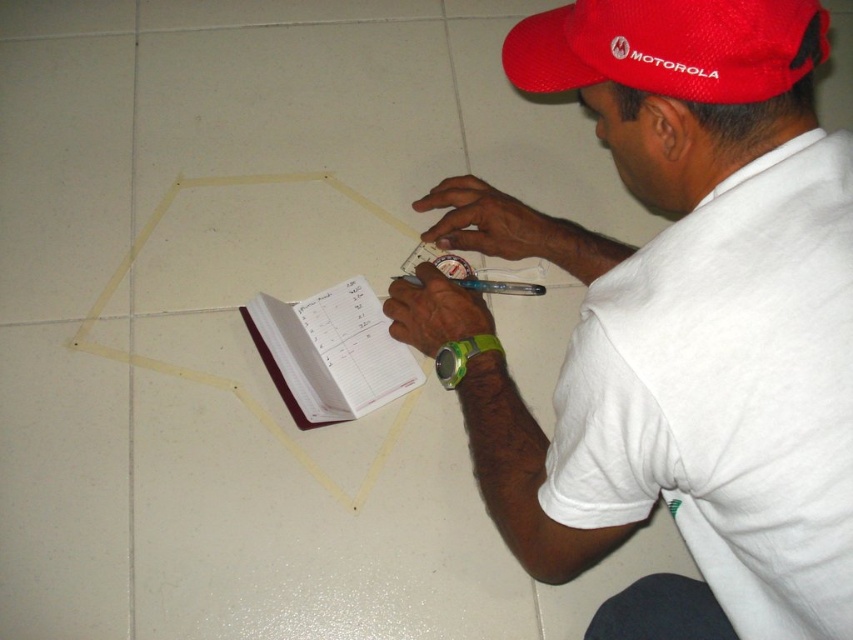
Is point (807, 372) positioned behind point (376, 323)?

No.

Does white matte shirt at center have a greater width compared to maroon leather notebook at center?

Indeed, white matte shirt at center has a greater width compared to maroon leather notebook at center.

Between point (692, 81) and point (389, 362), which one is positioned behind?

The point (389, 362) is more distant.

Locate an element on the screen. The image size is (853, 640). white matte shirt at center is located at coordinates (683, 323).

Between red mesh cap at upper center and maroon leather notebook at center, which one has more height?

With more height is maroon leather notebook at center.

Is point (579, 36) in front of point (352, 282)?

That is True.

You are a GUI agent. You are given a task and a screenshot of the screen. Output one action in this format:
    pyautogui.click(x=<x>, y=<y>)
    Task: Click on the red mesh cap at upper center
    
    Given the screenshot: What is the action you would take?
    pyautogui.click(x=670, y=48)

At what (x,y) coordinates should I click in order to perform the action: click on red mesh cap at upper center. Please return your answer as a coordinate pair (x, y). The image size is (853, 640). Looking at the image, I should click on (670, 48).

Which is in front, point (531, 17) or point (463, 352)?

Positioned in front is point (531, 17).

The image size is (853, 640). What do you see at coordinates (670, 48) in the screenshot?
I see `red mesh cap at upper center` at bounding box center [670, 48].

Between point (711, 88) and point (453, 381), which one is positioned behind?

The point (453, 381) is more distant.

What are the coordinates of `red mesh cap at upper center` in the screenshot? It's located at pos(670,48).